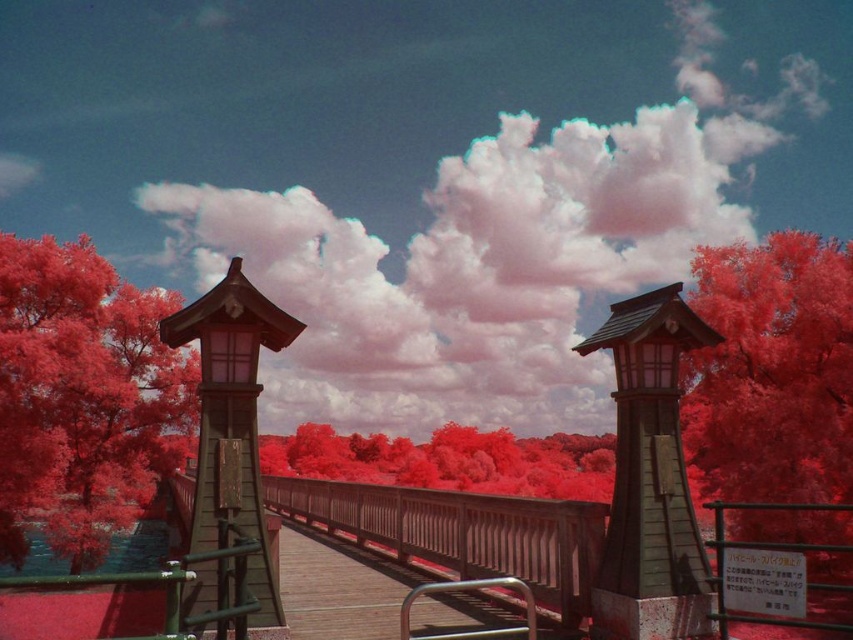
Is smooth red tree at left taller than wooden gazebo at center?

Yes, smooth red tree at left is taller than wooden gazebo at center.

Can you confirm if smooth red tree at left is smaller than wooden gazebo at center?

No.

Where is `smooth red tree at left`? This screenshot has height=640, width=853. smooth red tree at left is located at coordinates (82, 397).

Between wooden bridge at center and wooden gazebo at center, which one appears on the left side from the viewer's perspective?

Positioned to the left is wooden gazebo at center.

Describe the element at coordinates (442, 525) in the screenshot. I see `wooden bridge at center` at that location.

Does point (851, 588) come closer to viewer compared to point (228, 269)?

Yes, point (851, 588) is in front of point (228, 269).

At what (x,y) coordinates should I click in order to perform the action: click on wooden bridge at center. Please return your answer as a coordinate pair (x, y). Looking at the image, I should click on (442, 525).

Who is taller, smooth red tree at left or wooden bridge at center?

Standing taller between the two is smooth red tree at left.

Is point (173, 448) positioned behind point (534, 500)?

Yes.

Locate an element on the screen. The image size is (853, 640). smooth red tree at left is located at coordinates (82, 397).

Image resolution: width=853 pixels, height=640 pixels. I want to click on smooth red tree at left, so click(82, 397).